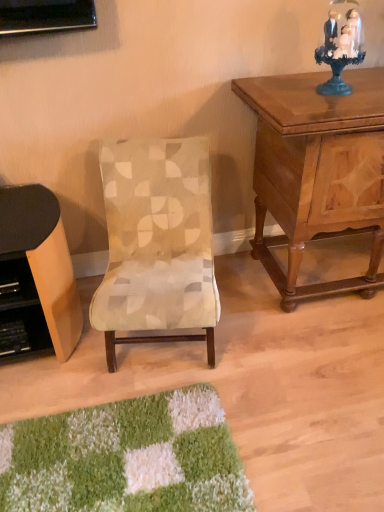
Identify the location of vacant area that is in front of beige fabric chair at center. The height and width of the screenshot is (512, 384). click(x=160, y=431).